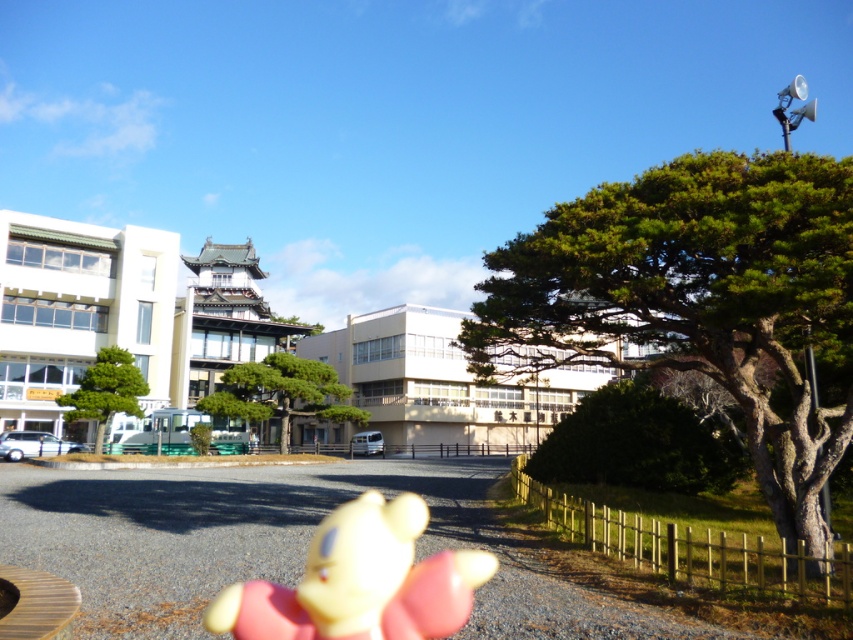
Is the position of green textured tree at right less distant than that of green matte tree at center?

Yes, it is in front of green matte tree at center.

At what (x,y) coordinates should I click in order to perform the action: click on green textured tree at right. Please return your answer as a coordinate pair (x, y). This screenshot has width=853, height=640. Looking at the image, I should click on (698, 301).

This screenshot has width=853, height=640. In order to click on green textured tree at center in this screenshot , I will do `click(281, 394)`.

Between point (257, 381) and point (94, 419), which one is positioned in front?

Point (94, 419) is more forward.

Where is `green textured tree at center`? The height and width of the screenshot is (640, 853). green textured tree at center is located at coordinates (281, 394).

Which is in front, point (404, 557) or point (241, 390)?

Point (404, 557)

Can you confirm if yellow matte teddy bear at lower center is smaller than green textured tree at center?

Indeed, yellow matte teddy bear at lower center has a smaller size compared to green textured tree at center.

At what (x,y) coordinates should I click in order to perform the action: click on yellow matte teddy bear at lower center. Please return your answer as a coordinate pair (x, y). Looking at the image, I should click on (x=360, y=580).

Image resolution: width=853 pixels, height=640 pixels. I want to click on yellow matte teddy bear at lower center, so click(x=360, y=580).